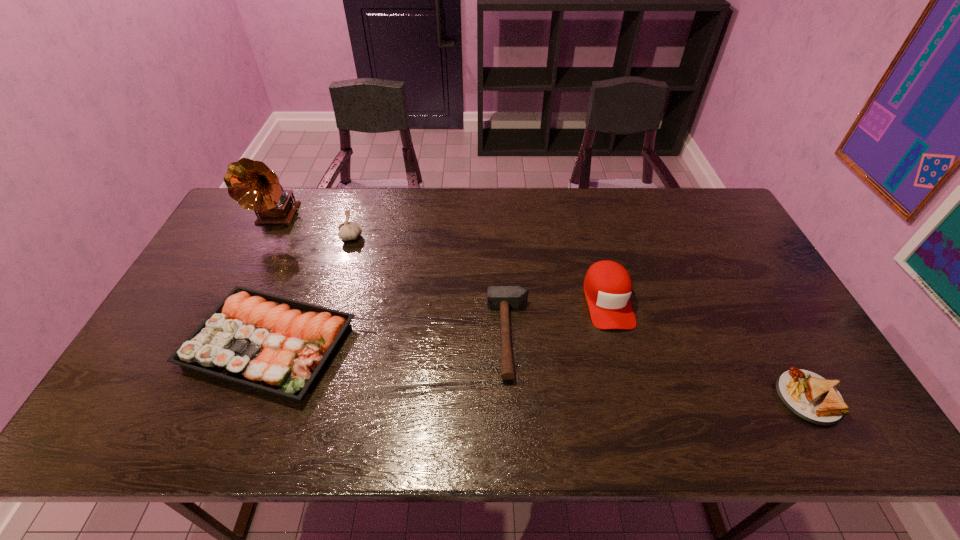
Locate an element on the screen. This screenshot has height=540, width=960. free space between the third object from right to left and the shortest object is located at coordinates (659, 367).

In order to click on the third closest object to the rightmost object in this screenshot , I will do `click(278, 345)`.

The height and width of the screenshot is (540, 960). What are the coordinates of `object that is the fifth nearest to the second object from right to left` in the screenshot? It's located at (252, 184).

This screenshot has width=960, height=540. In order to click on vacant space that satisfies the following two spatial constraints: 1. on the back side of the rightmost object; 2. on the striking surface of the hammer in this screenshot , I will do `click(773, 336)`.

This screenshot has height=540, width=960. What are the coordinates of `vacant region that satisfies the following two spatial constraints: 1. on the horn of the phonograph_record; 2. on the left side of the platter` in the screenshot? It's located at (211, 345).

Image resolution: width=960 pixels, height=540 pixels. I want to click on free location that satisfies the following two spatial constraints: 1. on the front-facing side of the fifth object from left to right; 2. on the right side of the sandwich, so click(x=634, y=397).

The image size is (960, 540). Find the location of `vacant region that satisfies the following two spatial constraints: 1. on the striking surface of the sandwich; 2. on the right side of the hammer`. vacant region that satisfies the following two spatial constraints: 1. on the striking surface of the sandwich; 2. on the right side of the hammer is located at coordinates pyautogui.click(x=513, y=397).

Find the location of a particular element. The image size is (960, 540). free spot that satisfies the following two spatial constraints: 1. on the horn of the tallest object; 2. on the right side of the garlic is located at coordinates (267, 237).

This screenshot has height=540, width=960. I want to click on vacant space that satisfies the following two spatial constraints: 1. on the front side of the shortest object; 2. on the left side of the platter, so click(x=248, y=397).

Identify the location of free location that satisfies the following two spatial constraints: 1. on the horn of the rightmost object; 2. on the right side of the tallest object. The width and height of the screenshot is (960, 540). (184, 397).